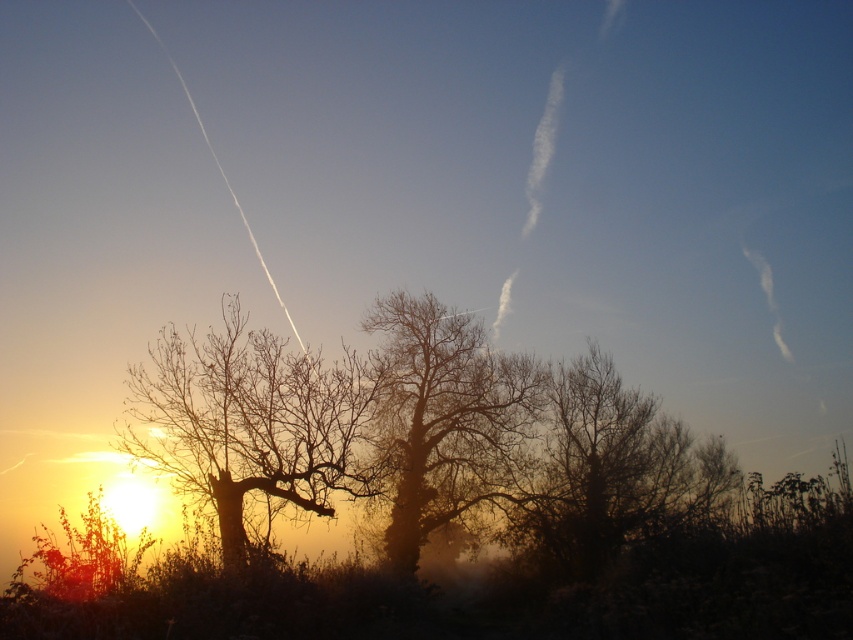
Question: Estimate the real-world distances between objects in this image. Which object is farther from the brown textured tree at center?

Choices:
 (A) bare wood tree at center
 (B) silhouette bare tree at left

Answer: (B)

Question: Which of these objects is positioned farthest from the brown textured tree at center?

Choices:
 (A) bare wood tree at center
 (B) silhouette bare tree at left

Answer: (B)

Question: Is bare wood tree at center to the left of brown textured tree at center from the viewer's perspective?

Choices:
 (A) yes
 (B) no

Answer: (A)

Question: Which of the following is the farthest from the observer?

Choices:
 (A) silhouette bare tree at left
 (B) brown textured tree at center

Answer: (B)

Question: Considering the relative positions of silhouette bare tree at left and brown textured tree at center in the image provided, where is silhouette bare tree at left located with respect to brown textured tree at center?

Choices:
 (A) right
 (B) left

Answer: (B)

Question: Considering the relative positions of silhouette bare tree at left and bare wood tree at center in the image provided, where is silhouette bare tree at left located with respect to bare wood tree at center?

Choices:
 (A) left
 (B) right

Answer: (A)